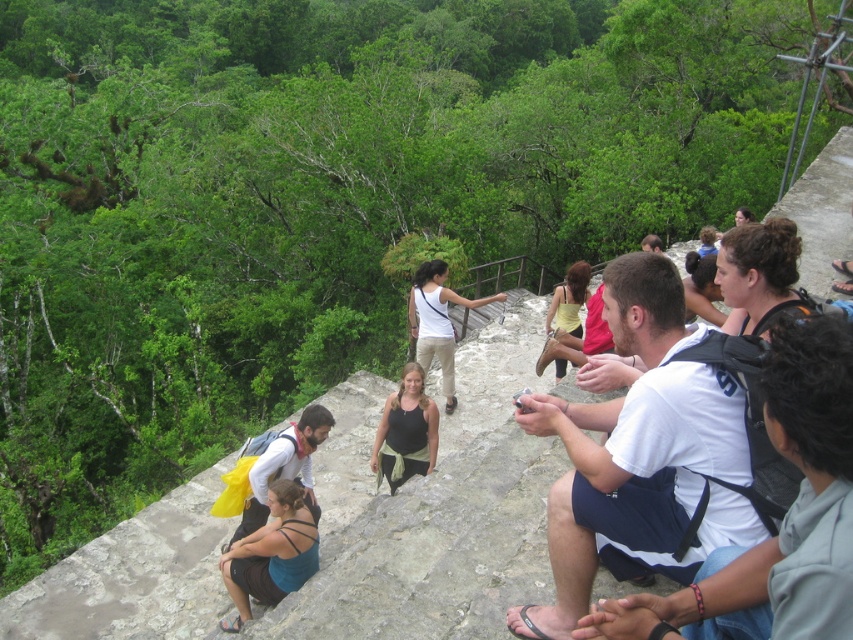
Can you confirm if dark blue backpack at center is taller than yellow fabric dress at center?

Yes.

Can you confirm if dark blue backpack at center is wider than yellow fabric dress at center?

Yes, dark blue backpack at center is wider than yellow fabric dress at center.

Does point (271, 465) come closer to viewer compared to point (567, 307)?

Yes, point (271, 465) is closer to viewer.

This screenshot has width=853, height=640. What are the coordinates of `dark blue backpack at center` in the screenshot? It's located at (285, 467).

Looking at this image, does white cotton shirt at right lie behind matte white tank top at center?

No, white cotton shirt at right is closer to the viewer.

Is white cotton shirt at right closer to the viewer compared to matte white tank top at center?

Yes, white cotton shirt at right is in front of matte white tank top at center.

Which is in front, point (675, 627) or point (444, 305)?

Point (675, 627) is more forward.

The width and height of the screenshot is (853, 640). What are the coordinates of `white cotton shirt at right` in the screenshot? It's located at (782, 520).

Does teal fabric tank top at lower left have a lesser height compared to brown hair at upper right?

In fact, teal fabric tank top at lower left may be taller than brown hair at upper right.

Is point (299, 556) farther from viewer compared to point (749, 284)?

Yes, it is behind point (749, 284).

Between point (242, 593) and point (734, 324), which one is positioned behind?

The point (242, 593) is more distant.

Find the location of `teal fabric tank top at lower left`. teal fabric tank top at lower left is located at coordinates 271,554.